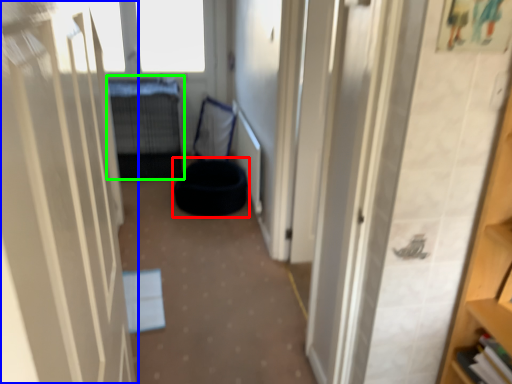
Question: Considering the real-world distances, which object is farthest from bean bag chair (highlighted by a red box)? door (highlighted by a blue box) or bed (highlighted by a green box)?

Choices:
 (A) door
 (B) bed

Answer: (A)